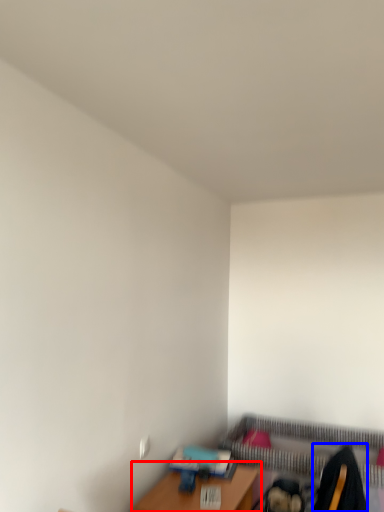
Question: Which of the following is the closest to the observer, table (highlighted by a red box) or swivel chair (highlighted by a blue box)?

Choices:
 (A) table
 (B) swivel chair

Answer: (B)